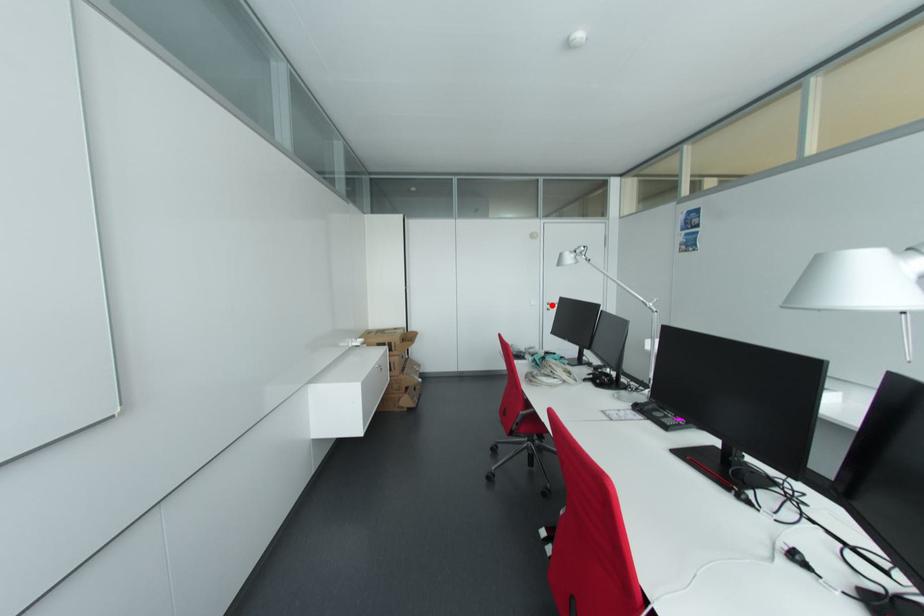
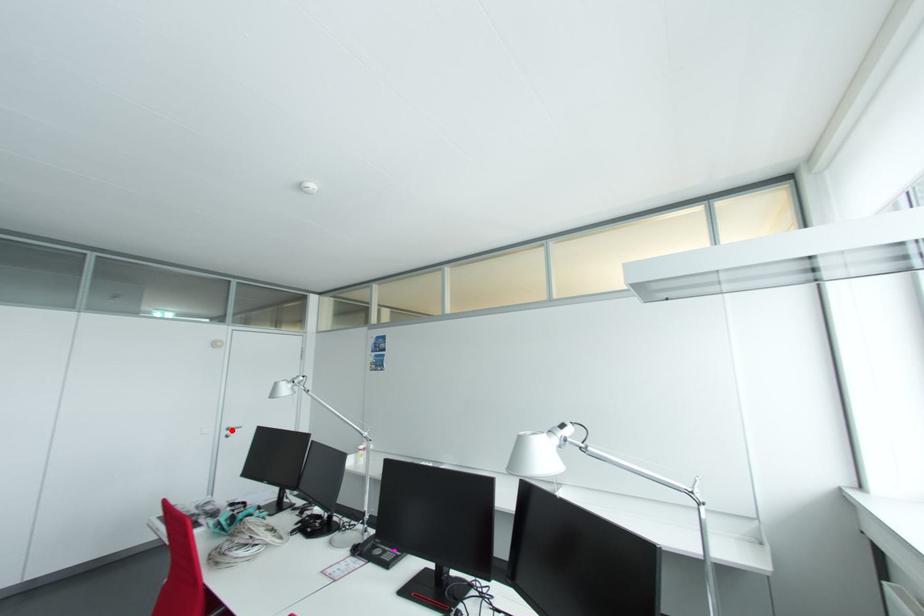
I am providing you with two images of the same scene from different viewpoints. A red point is marked on the first image and another point is marked on the second image. Do the highlighted points in image1 and image2 indicate the same real-world spot?

Yes